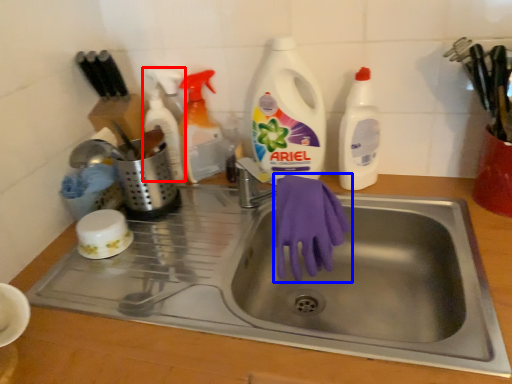
Question: Among these objects, which one is farthest to the camera, cleaning product (highlighted by a red box) or glove (highlighted by a blue box)?

Choices:
 (A) cleaning product
 (B) glove

Answer: (A)